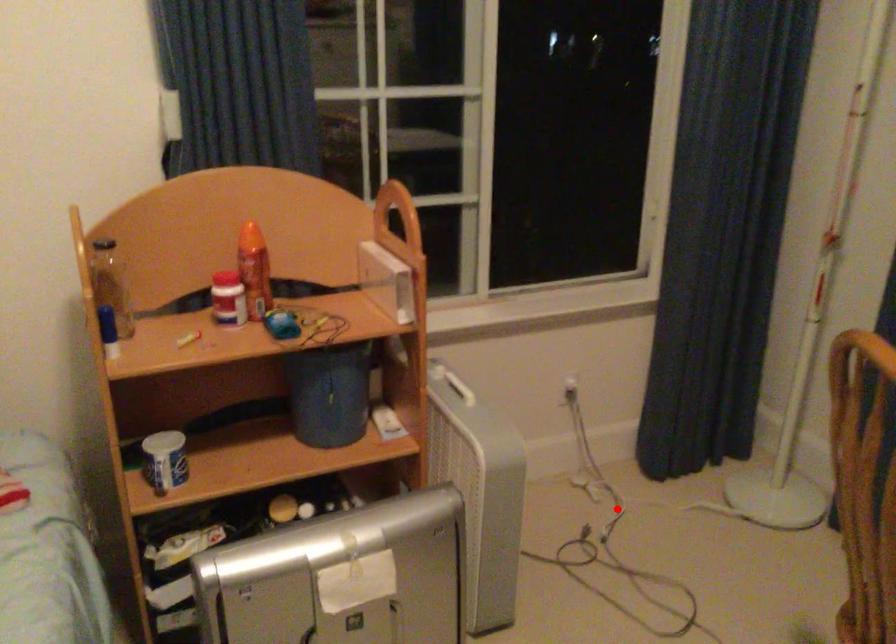
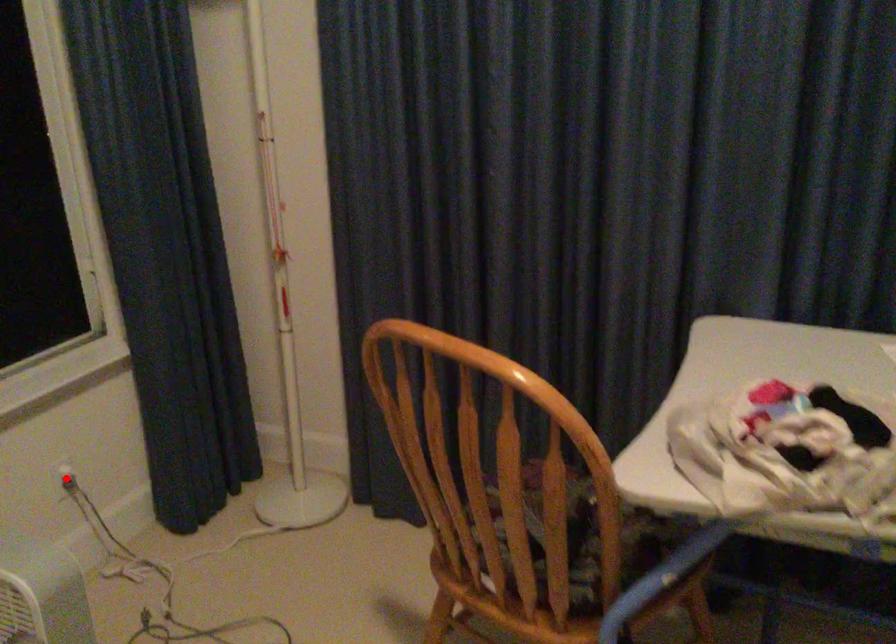
I am providing you with two images of the same scene from different viewpoints. A red point is marked on the first image and another point is marked on the second image. Does the point marked in image1 correspond to the same location as the one in image2?

No